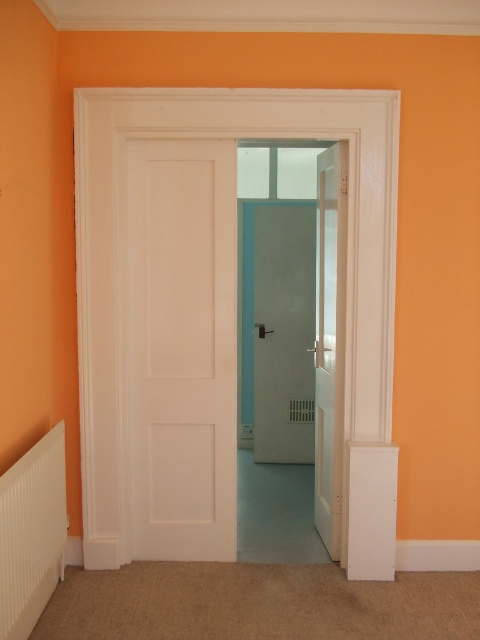
Between matte white door at center and white glossy door at center, which one has less height?

matte white door at center

Where is `matte white door at center`? matte white door at center is located at coordinates (284, 332).

Where is `matte white door at center`? This screenshot has height=640, width=480. matte white door at center is located at coordinates (284, 332).

Does white matte door at center appear under white plastic radiator at lower left?

No, white matte door at center is not below white plastic radiator at lower left.

Between white matte door at center and white plastic radiator at lower left, which one is positioned lower?

white plastic radiator at lower left

Locate an element on the screen. This screenshot has width=480, height=640. white matte door at center is located at coordinates (180, 348).

Consider the image. Is matte white door at center shorter than white plastic radiator at lower left?

Incorrect, matte white door at center's height does not fall short of white plastic radiator at lower left's.

Is matte white door at center smaller than white plastic radiator at lower left?

No.

Between point (299, 236) and point (7, 628), which one is positioned in front?

Point (7, 628) is more forward.

Find the location of a particular element. The width and height of the screenshot is (480, 640). matte white door at center is located at coordinates (284, 332).